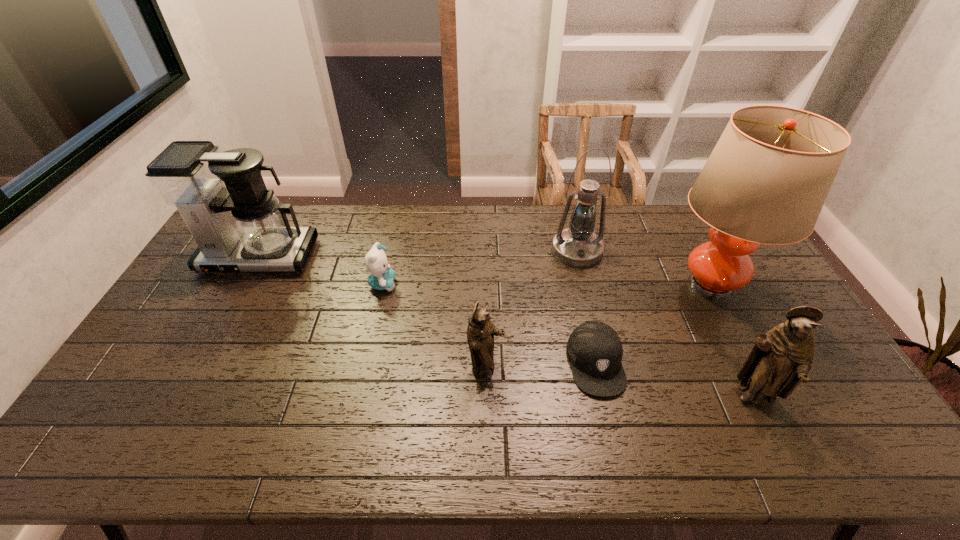
Find the location of a particular element. The width and height of the screenshot is (960, 540). free space between the coffee maker and the sixth object from right to left is located at coordinates (321, 271).

I want to click on free space between the third object from left to right and the kitten, so click(434, 326).

At what (x,y) coordinates should I click in order to perform the action: click on unoccupied position between the fifth tallest object and the leftmost object. Please return your answer as a coordinate pair (x, y). Looking at the image, I should click on (372, 313).

At what (x,y) coordinates should I click in order to perform the action: click on empty space that is in between the oil lamp and the fourth shortest object. Please return your answer as a coordinate pair (x, y). Looking at the image, I should click on (665, 324).

The image size is (960, 540). I want to click on vacant area between the third object from left to right and the shortest object, so click(x=540, y=366).

Where is `free space between the shortest object and the leftmost object`? The height and width of the screenshot is (540, 960). free space between the shortest object and the leftmost object is located at coordinates (427, 310).

The width and height of the screenshot is (960, 540). What are the coordinates of `vacant area that lies between the shortest object and the right figurine` in the screenshot? It's located at (675, 380).

Identify which object is the fourth nearest to the second object from left to right. Please provide its 2D coordinates. Your answer should be formatted as a tuple, i.e. [(x, y)], where the tuple contains the x and y coordinates of a point satisfying the conditions above.

[(595, 351)]

Select which object is the sixth closest to the coffee maker. Please provide its 2D coordinates. Your answer should be formatted as a tuple, i.e. [(x, y)], where the tuple contains the x and y coordinates of a point satisfying the conditions above.

[(781, 359)]

I want to click on free space that satisfies the following two spatial constraints: 1. on the face of the sixth tallest object; 2. on the back side of the tallest object, so click(x=382, y=285).